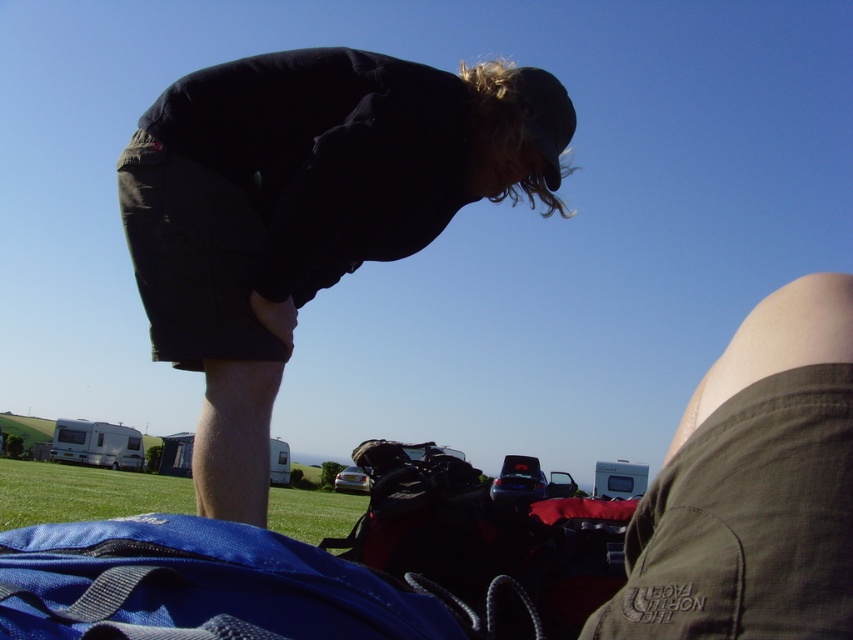
Is black fabric man at center taller than blue fabric sleeping bag at lower left?

Correct, black fabric man at center is much taller as blue fabric sleeping bag at lower left.

Is black fabric man at center bigger than blue fabric sleeping bag at lower left?

Indeed, black fabric man at center has a larger size compared to blue fabric sleeping bag at lower left.

The image size is (853, 640). What are the coordinates of `black fabric man at center` in the screenshot? It's located at (306, 209).

Can you confirm if black fabric man at center is wider than green grass at lower left?

No.

Measure the distance between black fabric man at center and camera.

black fabric man at center is 2.15 meters from camera.

Image resolution: width=853 pixels, height=640 pixels. In order to click on black fabric man at center in this screenshot , I will do `click(306, 209)`.

The height and width of the screenshot is (640, 853). What do you see at coordinates (196, 586) in the screenshot?
I see `blue fabric sleeping bag at lower left` at bounding box center [196, 586].

Can you confirm if blue fabric sleeping bag at lower left is shorter than green grass at lower left?

Yes.

Locate an element on the screen. The image size is (853, 640). blue fabric sleeping bag at lower left is located at coordinates (196, 586).